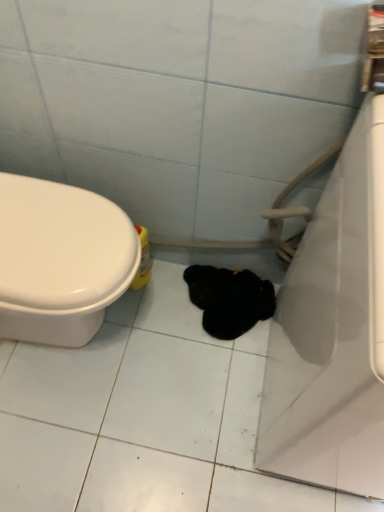
Question: Is yellow plastic bottle at lower left positioned with its back to black fuzzy animal at center?

Choices:
 (A) no
 (B) yes

Answer: (A)

Question: Is yellow plastic bottle at lower left to the right of black fuzzy animal at center from the viewer's perspective?

Choices:
 (A) yes
 (B) no

Answer: (B)

Question: Is yellow plastic bottle at lower left oriented towards black fuzzy animal at center?

Choices:
 (A) yes
 (B) no

Answer: (A)

Question: Is black fuzzy animal at center completely or partially inside yellow plastic bottle at lower left?

Choices:
 (A) no
 (B) yes

Answer: (A)

Question: From a real-world perspective, is yellow plastic bottle at lower left located higher than black fuzzy animal at center?

Choices:
 (A) no
 (B) yes

Answer: (B)

Question: Does yellow plastic bottle at lower left have a greater height compared to black fuzzy animal at center?

Choices:
 (A) yes
 (B) no

Answer: (A)

Question: Does white glossy bathtub at right appear on the left side of black fuzzy animal at center?

Choices:
 (A) yes
 (B) no

Answer: (B)

Question: Considering the relative positions of white glossy bathtub at right and black fuzzy animal at center in the image provided, is white glossy bathtub at right behind black fuzzy animal at center?

Choices:
 (A) no
 (B) yes

Answer: (A)

Question: Does white glossy bathtub at right have a lesser height compared to black fuzzy animal at center?

Choices:
 (A) yes
 (B) no

Answer: (B)

Question: Is white glossy bathtub at right to the right of black fuzzy animal at center from the viewer's perspective?

Choices:
 (A) yes
 (B) no

Answer: (A)

Question: Considering the relative sizes of white glossy bathtub at right and black fuzzy animal at center in the image provided, is white glossy bathtub at right wider than black fuzzy animal at center?

Choices:
 (A) no
 (B) yes

Answer: (B)

Question: Is white glossy bathtub at right aimed at black fuzzy animal at center?

Choices:
 (A) yes
 (B) no

Answer: (B)

Question: Considering the relative sizes of black fuzzy animal at center and yellow plastic bottle at lower left in the image provided, is black fuzzy animal at center thinner than yellow plastic bottle at lower left?

Choices:
 (A) no
 (B) yes

Answer: (A)